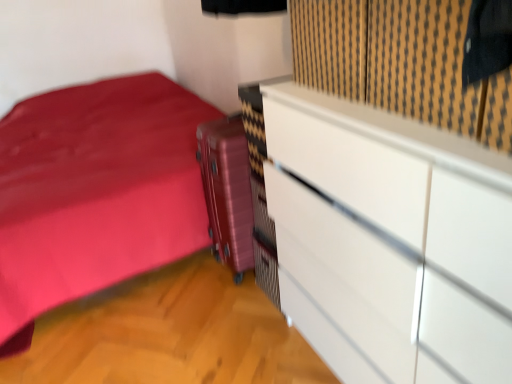
Question: Is white glossy chest of drawers at upper right not inside black textured curtain at upper right?

Choices:
 (A) yes
 (B) no

Answer: (A)

Question: From the image's perspective, is white glossy chest of drawers at upper right located beneath black textured curtain at upper right?

Choices:
 (A) no
 (B) yes

Answer: (B)

Question: Is white glossy chest of drawers at upper right further to camera compared to black textured curtain at upper right?

Choices:
 (A) no
 (B) yes

Answer: (A)

Question: Considering the relative sizes of white glossy chest of drawers at upper right and black textured curtain at upper right in the image provided, is white glossy chest of drawers at upper right thinner than black textured curtain at upper right?

Choices:
 (A) yes
 (B) no

Answer: (B)

Question: Is white glossy chest of drawers at upper right at the left side of black textured curtain at upper right?

Choices:
 (A) yes
 (B) no

Answer: (A)

Question: Is white glossy chest of drawers at upper right positioned before black textured curtain at upper right?

Choices:
 (A) no
 (B) yes

Answer: (B)

Question: Is black textured curtain at upper right positioned with its back to metallic pink suitcase at center?

Choices:
 (A) no
 (B) yes

Answer: (A)

Question: Does black textured curtain at upper right appear on the left side of metallic pink suitcase at center?

Choices:
 (A) yes
 (B) no

Answer: (B)

Question: Is black textured curtain at upper right not within metallic pink suitcase at center?

Choices:
 (A) no
 (B) yes

Answer: (B)

Question: Could you tell me if black textured curtain at upper right is facing metallic pink suitcase at center?

Choices:
 (A) yes
 (B) no

Answer: (B)

Question: Is the surface of black textured curtain at upper right in direct contact with metallic pink suitcase at center?

Choices:
 (A) no
 (B) yes

Answer: (A)

Question: Does black textured curtain at upper right have a smaller size compared to metallic pink suitcase at center?

Choices:
 (A) no
 (B) yes

Answer: (B)

Question: Does white glossy chest of drawers at upper right appear on the left side of metallic pink suitcase at center?

Choices:
 (A) no
 (B) yes

Answer: (A)